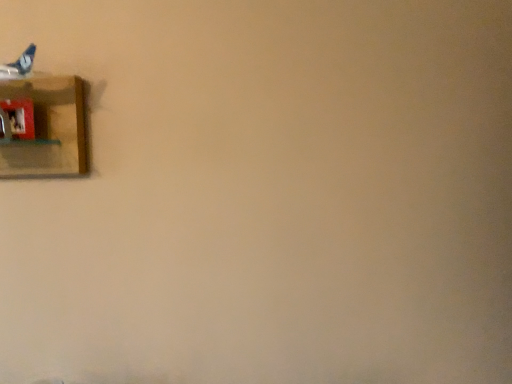
Image resolution: width=512 pixels, height=384 pixels. Find the location of `matte red toy airplane at upper left`. matte red toy airplane at upper left is located at coordinates (20, 117).

What do you see at coordinates (20, 117) in the screenshot?
I see `matte red toy airplane at upper left` at bounding box center [20, 117].

This screenshot has height=384, width=512. I want to click on matte red toy airplane at upper left, so click(20, 117).